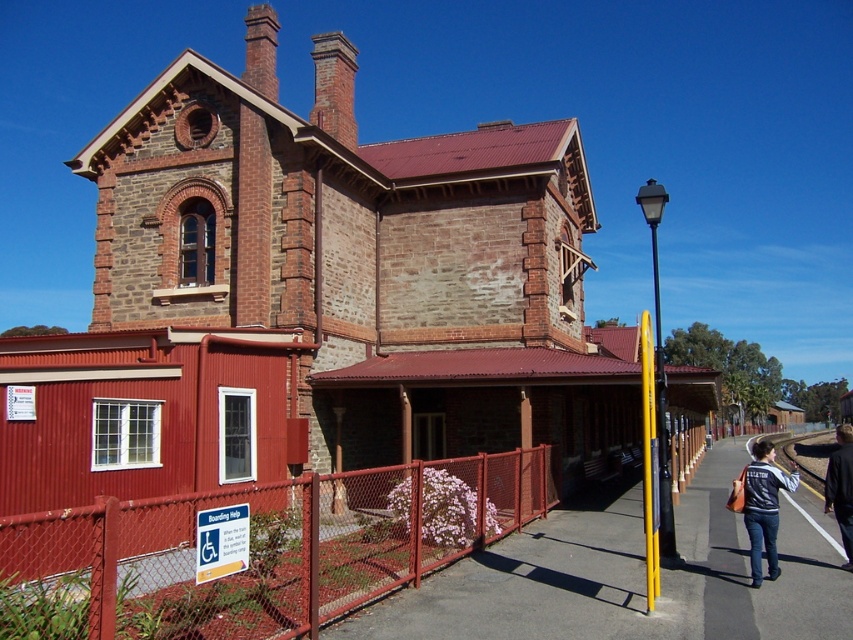
Is dark blue jacket at lower right below smooth concrete train track at lower right?

Incorrect, dark blue jacket at lower right is not positioned below smooth concrete train track at lower right.

Can you confirm if dark blue jacket at lower right is taller than smooth concrete train track at lower right?

Yes.

I want to click on dark blue jacket at lower right, so click(840, 488).

Is point (439, 284) positioned behind point (770, 563)?

Yes, point (439, 284) is farther from viewer.

From the picture: Who is more forward, (x=270, y=289) or (x=772, y=454)?

Point (x=772, y=454) is more forward.

Locate an element on the screen. brick stone church at center is located at coordinates (364, 259).

Who is more forward, (91,632) or (772,448)?

Point (91,632) is in front.

Can you confirm if red chain-link fence at lower left is taller than denim jacket at lower right?

Incorrect, red chain-link fence at lower left's height is not larger of denim jacket at lower right's.

Is point (71, 608) farther from camera compared to point (769, 573)?

No, (71, 608) is in front of (769, 573).

At what (x,y) coordinates should I click in order to perform the action: click on red chain-link fence at lower left. Please return your answer as a coordinate pair (x, y). The image size is (853, 640). Looking at the image, I should click on (262, 548).